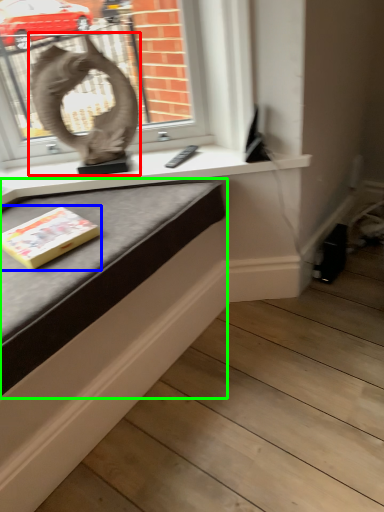
Question: Which object is the closest to the sculpture (highlighted by a red box)? Choose among these: paperback book (highlighted by a blue box) or table (highlighted by a green box).

Choices:
 (A) paperback book
 (B) table

Answer: (B)